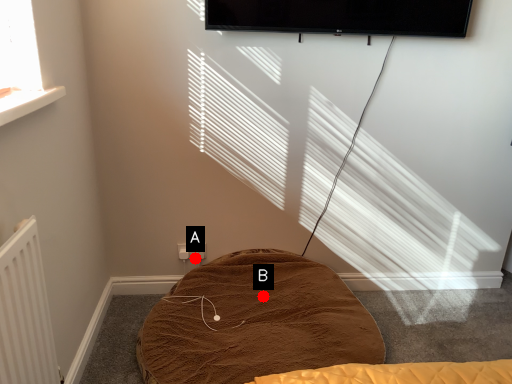
Question: Two points are circled on the image, labeled by A and B beside each circle. Among these points, which one is farthest from the camera?

Choices:
 (A) A is further
 (B) B is further

Answer: (A)